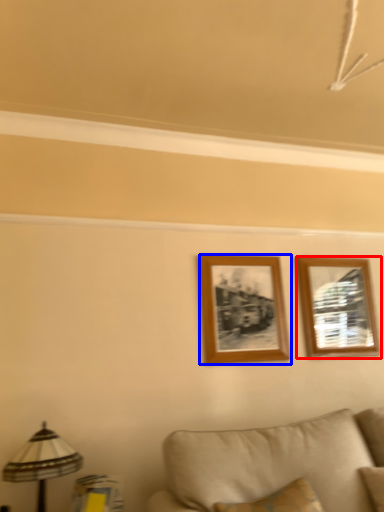
Question: Among these objects, which one is farthest to the camera, picture frame (highlighted by a red box) or picture frame (highlighted by a blue box)?

Choices:
 (A) picture frame
 (B) picture frame

Answer: (A)